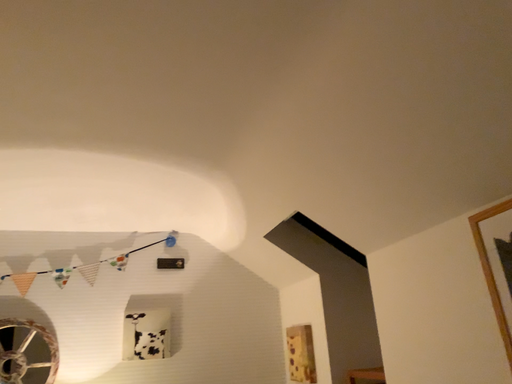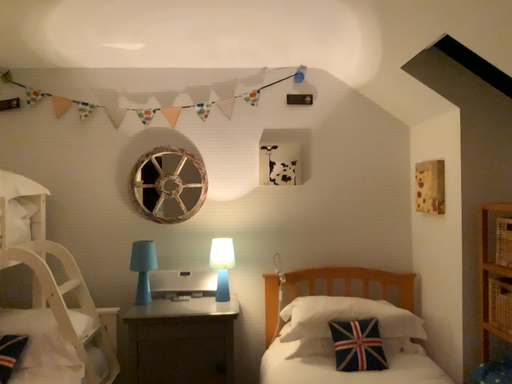
Question: How did the camera likely rotate when shooting the video?

Choices:
 (A) rotated left
 (B) rotated right

Answer: (A)